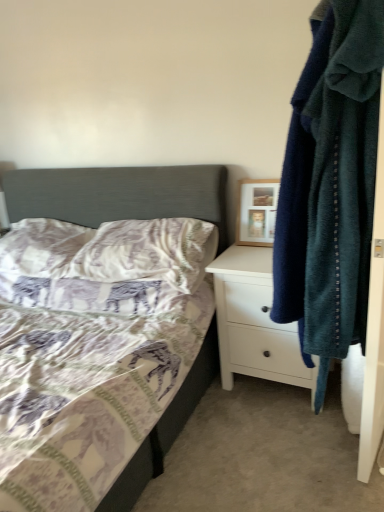
Question: Does wooden picture frame at upper right have a lesser height compared to soft blue towel at right?

Choices:
 (A) yes
 (B) no

Answer: (A)

Question: Is wooden picture frame at upper right far from soft blue towel at right?

Choices:
 (A) yes
 (B) no

Answer: (B)

Question: Is soft blue towel at right at the back of wooden picture frame at upper right?

Choices:
 (A) yes
 (B) no

Answer: (B)

Question: Can you confirm if wooden picture frame at upper right is taller than soft blue towel at right?

Choices:
 (A) no
 (B) yes

Answer: (A)

Question: Is wooden picture frame at upper right to the left of soft blue towel at right from the viewer's perspective?

Choices:
 (A) yes
 (B) no

Answer: (A)

Question: In terms of size, does white matte chest of drawers at right appear bigger or smaller than patterned fabric pillow at center, acting as the 1th pillow starting from the right?

Choices:
 (A) big
 (B) small

Answer: (A)

Question: Choose the correct answer: Is white matte chest of drawers at right inside patterned fabric pillow at center, acting as the 1th pillow starting from the right, or outside it?

Choices:
 (A) outside
 (B) inside

Answer: (A)

Question: From the image's perspective, is white matte chest of drawers at right above or below patterned fabric pillow at center, acting as the 1th pillow starting from the right?

Choices:
 (A) below
 (B) above

Answer: (A)

Question: Considering the positions of white matte chest of drawers at right and patterned fabric pillow at center, acting as the 1th pillow starting from the right, in the image, is white matte chest of drawers at right wider or thinner than patterned fabric pillow at center, acting as the 1th pillow starting from the right,?

Choices:
 (A) thin
 (B) wide

Answer: (B)

Question: Is soft blue towel at right inside the boundaries of patterned fabric bed at center, or outside?

Choices:
 (A) inside
 (B) outside

Answer: (B)

Question: From a real-world perspective, is soft blue towel at right above or below patterned fabric bed at center?

Choices:
 (A) below
 (B) above

Answer: (B)

Question: Relative to patterned fabric bed at center, is soft blue towel at right in front or behind?

Choices:
 (A) behind
 (B) front

Answer: (A)

Question: From the image's perspective, relative to patterned fabric bed at center, is soft blue towel at right above or below?

Choices:
 (A) below
 (B) above

Answer: (B)

Question: Considering their positions, is white matte chest of drawers at right located in front of or behind wooden picture frame at upper right?

Choices:
 (A) behind
 (B) front

Answer: (B)

Question: Considering the positions of white matte chest of drawers at right and wooden picture frame at upper right in the image, is white matte chest of drawers at right taller or shorter than wooden picture frame at upper right?

Choices:
 (A) short
 (B) tall

Answer: (B)